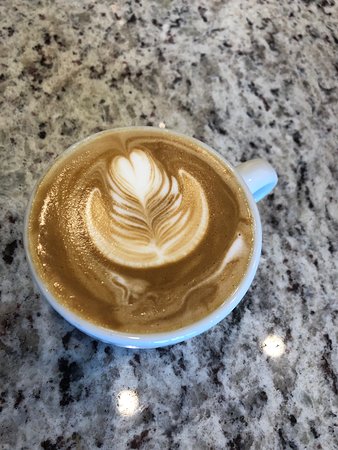
You are a GUI agent. You are given a task and a screenshot of the screen. Output one action in this format:
    pyautogui.click(x=<x>, y=<y>)
    Task: Click on the counter
    The height and width of the screenshot is (450, 338).
    Given the screenshot: What is the action you would take?
    pyautogui.click(x=117, y=39), pyautogui.click(x=297, y=154), pyautogui.click(x=289, y=338), pyautogui.click(x=139, y=394)